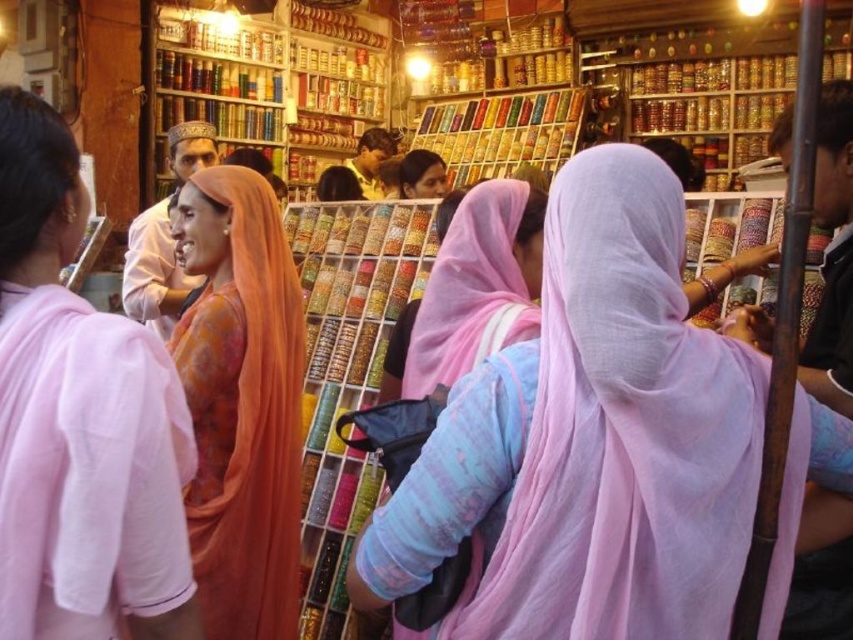
You are a customer in the market and want to buy the light pink sheer scarf at center and the orange silk saree at center. Which item is closer to you as you stand in front of the stalls?

The light pink sheer scarf at center is closer to you since it is in front of the orange silk saree at center.

You are a customer in the market and want to examine both the orange silk saree at center and the matte orange robe at center. Which one can you see more clearly from your current position?

The orange silk saree at center is closer to the viewer than the matte orange robe at center, so you can see the orange silk saree at center more clearly from your current position.

You are a customer in this market and want to buy an orange garment. You see an orange silk saree at center and a matte orange robe at center. Which one is taller?

The orange silk saree at center is much taller than the matte orange robe at center.